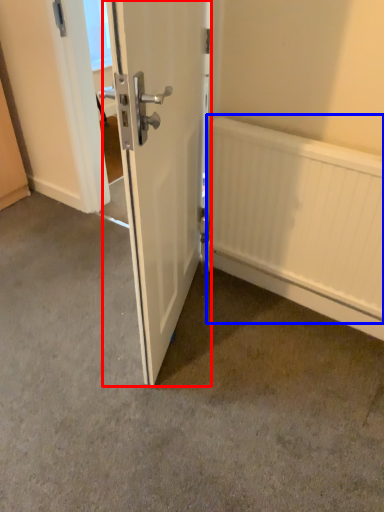
Question: Which object appears closest to the camera in this image, door (highlighted by a red box) or radiator (highlighted by a blue box)?

Choices:
 (A) door
 (B) radiator

Answer: (A)